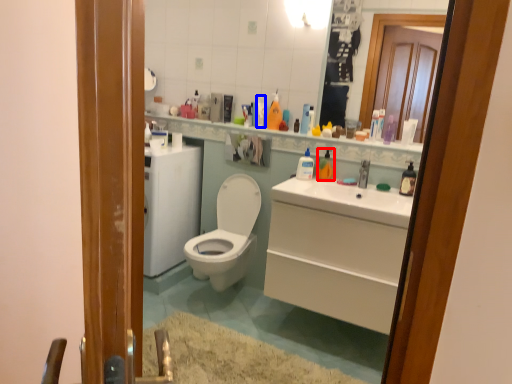
Question: Which object is closer to the camera taking this photo, cleaning product (highlighted by a red box) or toiletry (highlighted by a blue box)?

Choices:
 (A) cleaning product
 (B) toiletry

Answer: (A)